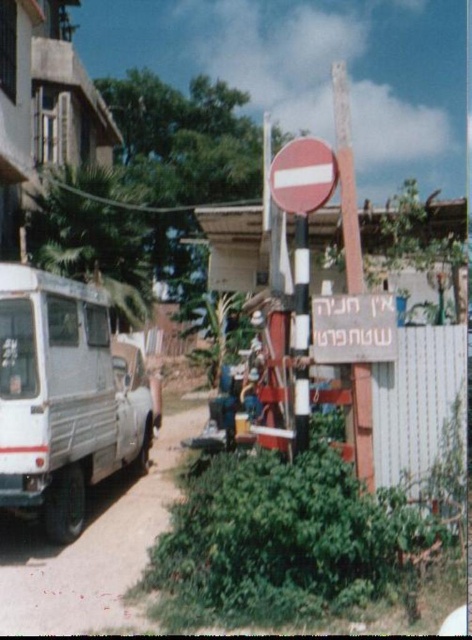
You are a pedestrian standing in front of the smooth wooden signpost at center and the smooth red circle at center. Which object is positioned to the left?

The smooth red circle at center is positioned to the left of the smooth wooden signpost at center.

From the picture: You are a delivery person trying to park your van which is 14 feet long. You see the white plastic sign at center and the white striped pole at center. Can your van fit between them without touching either?

The distance between the white plastic sign at center and the white striped pole at center is 14.19 inches, which is much shorter than your 14 feet long van. Therefore, your van cannot fit between them without touching either.